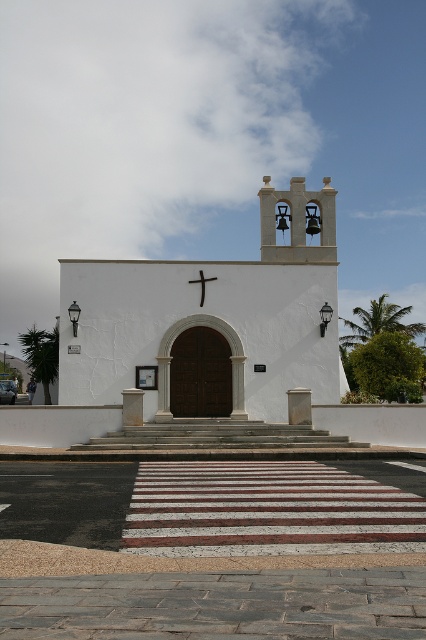
Based on the photo, does white stucco chapel at center appear under white stone stairs at center?

Incorrect, white stucco chapel at center is not positioned below white stone stairs at center.

Is the position of white stucco chapel at center more distant than that of white stone stairs at center?

Yes.

In order to click on white stucco chapel at center in this screenshot , I will do `click(210, 323)`.

Find the location of a particular element. The height and width of the screenshot is (640, 426). white stucco chapel at center is located at coordinates (210, 323).

Does point (244, 292) come in front of point (293, 234)?

Yes, it is in front of point (293, 234).

Find the location of a particular element. Image resolution: width=426 pixels, height=640 pixels. white stucco chapel at center is located at coordinates (210, 323).

Is white stone stairs at center below white stucco bell tower at upper center?

Correct, white stone stairs at center is located below white stucco bell tower at upper center.

Based on the photo, can you confirm if white stone stairs at center is positioned to the left of white stucco bell tower at upper center?

Yes, white stone stairs at center is to the left of white stucco bell tower at upper center.

The height and width of the screenshot is (640, 426). In order to click on white stone stairs at center in this screenshot , I will do `click(215, 435)`.